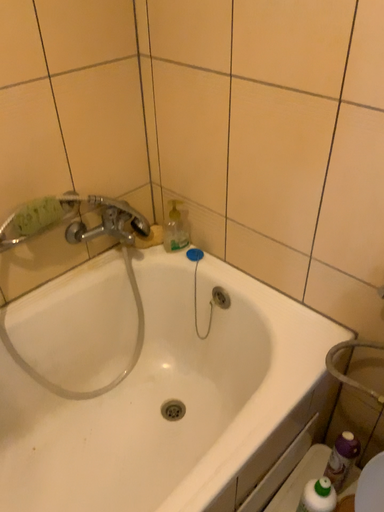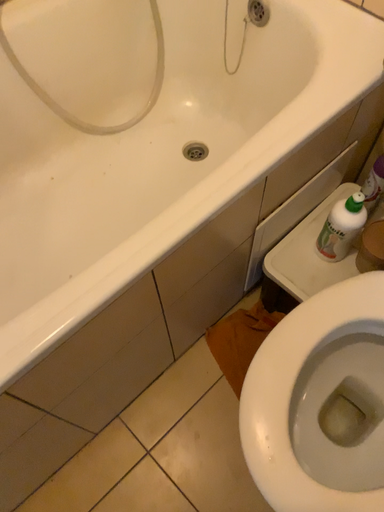
Question: How did the camera likely rotate when shooting the video?

Choices:
 (A) rotated downward
 (B) rotated upward

Answer: (A)